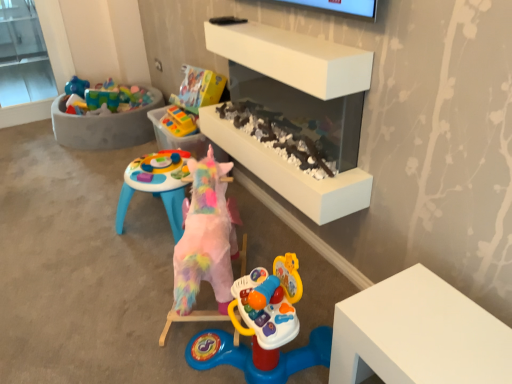
Question: Is white matte fireplace at center situated inside concrete tub at upper left or outside?

Choices:
 (A) outside
 (B) inside

Answer: (A)

Question: Looking at their shapes, would you say white matte fireplace at center is wider or thinner than concrete tub at upper left?

Choices:
 (A) thin
 (B) wide

Answer: (A)

Question: Which object is positioned farthest from the concrete tub at upper left?

Choices:
 (A) white matte fireplace at center
 (B) rubberized plastic toy at center, which is the first toy in back-to-front order
 (C) fuzzy pink unicorn at center, arranged as the first toy when ordered from the bottom

Answer: (C)

Question: Estimate the real-world distances between objects in this image. Which object is closer to the white matte fireplace at center?

Choices:
 (A) concrete tub at upper left
 (B) fuzzy pink unicorn at center, which is the second toy in back-to-front order
 (C) rubberized plastic toy at center, the 1th toy in the top-to-bottom sequence

Answer: (B)